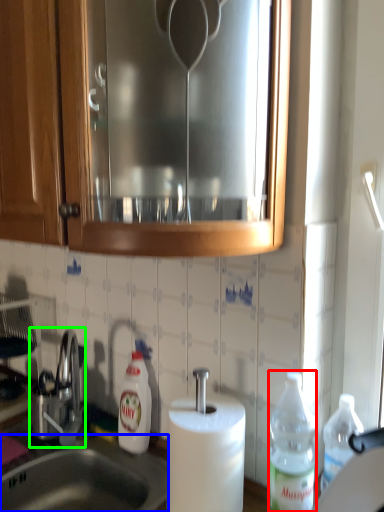
Question: Which object is positioned farthest from bottle (highlighted by a red box)? Select from sink (highlighted by a blue box) and tap (highlighted by a green box).

Choices:
 (A) sink
 (B) tap

Answer: (B)